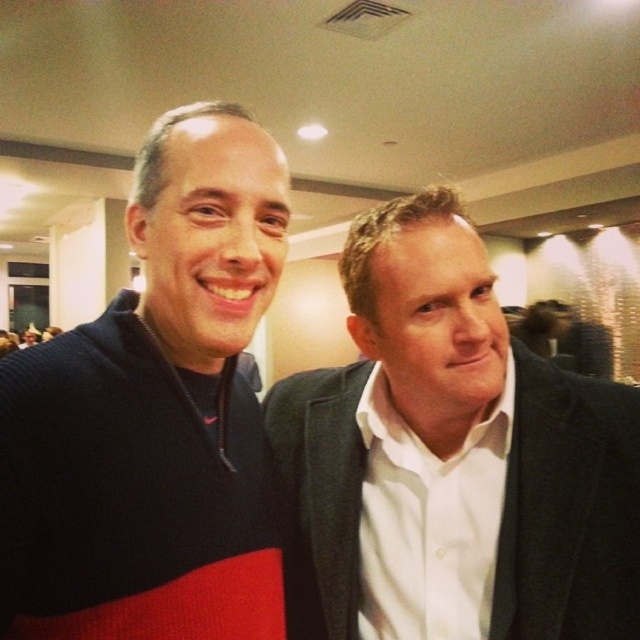
You are standing in the room and want to hand a document to both the white matte suit at center and the knit sweater at left. Which person should you approach first to ensure you can reach them without moving past the other?

You should approach the white matte suit at center first because it is closer to you than the knit sweater at left, which is further away.

You are at a formal event and need to locate the white matte suit at center and the knit sweater at left. According to the scene, which object is positioned to the right of the other?

The white matte suit at center is to the right of the knit sweater at left.

You are standing in a room and see the white matte suit at center. If you want to reach the suit without moving your feet, can you do it?

The white matte suit at center is 23.46 inches away from the viewer. Since this distance is within typical arm reach for most people, you can likely reach the suit without moving your feet.